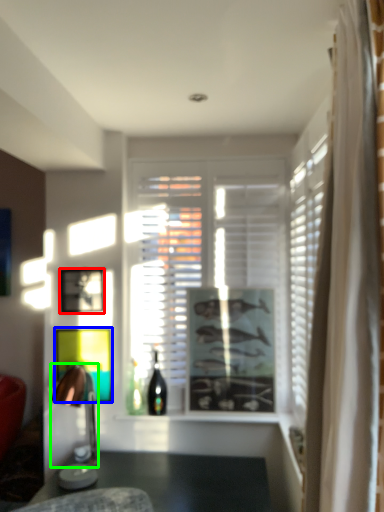
Question: Based on their relative distances, which object is farther from picture frame (highlighted by a red box)? Choose from picture frame (highlighted by a blue box) and lamp (highlighted by a green box).

Choices:
 (A) picture frame
 (B) lamp

Answer: (B)